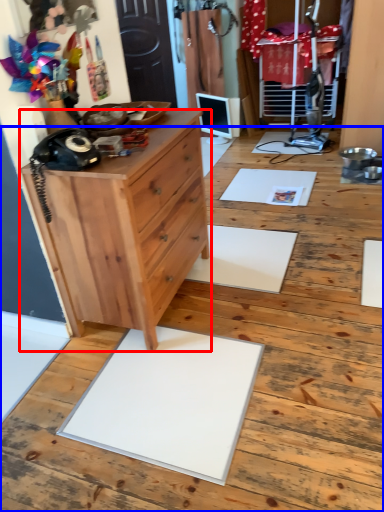
Question: Among these objects, which one is nearest to the camera, chest of drawers (highlighted by a red box) or hardwood (highlighted by a blue box)?

Choices:
 (A) chest of drawers
 (B) hardwood

Answer: (A)